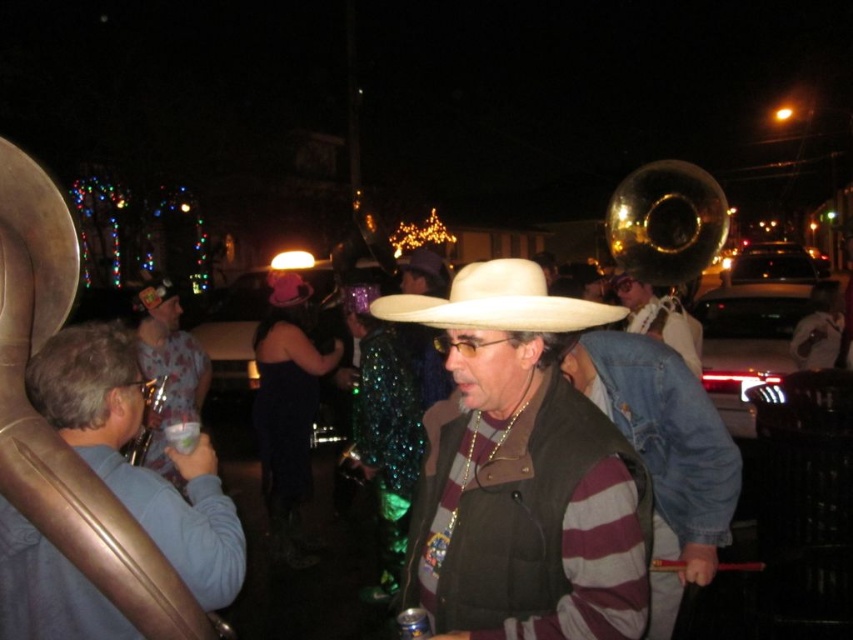
You are a photographer trying to capture a group photo of the striped sweater at center and the brushed metal saxophone at left. If you want to ensure both fit in the frame, which object should you focus on to avoid cropping?

You should focus on the striped sweater at center because it has a larger width than the brushed metal saxophone at left, so centering on it would ensure both fit without cropping.

You are a photographer trying to capture a closeup shot of the blue fabric shirt at left and the brushed metal saxophone at left. Since you want both to be in focus, which one should you focus on first to ensure the other is also sharp?

The blue fabric shirt at left is smaller than the brushed metal saxophone at left, so you should focus on the smaller object first, which is the blue fabric shirt at left, to ensure both are in focus.